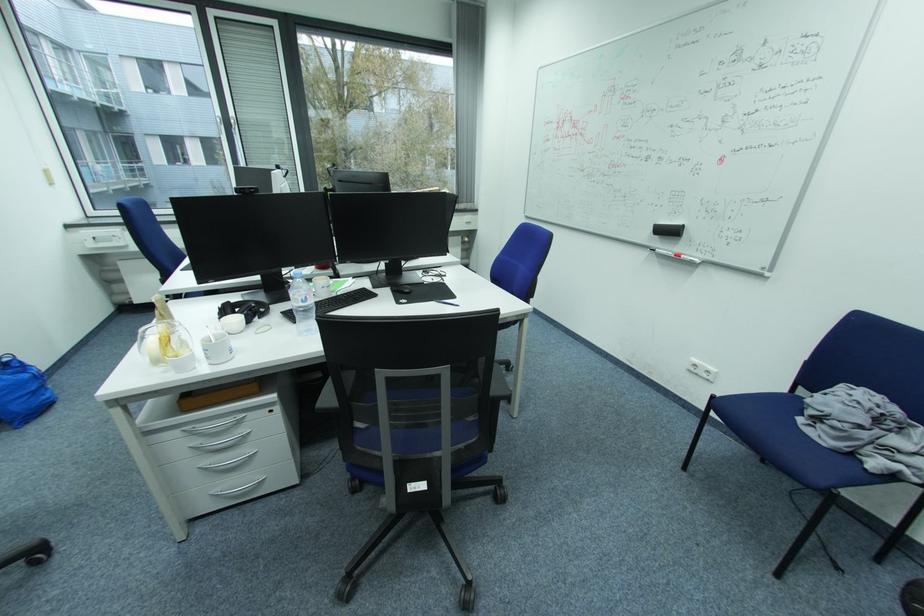
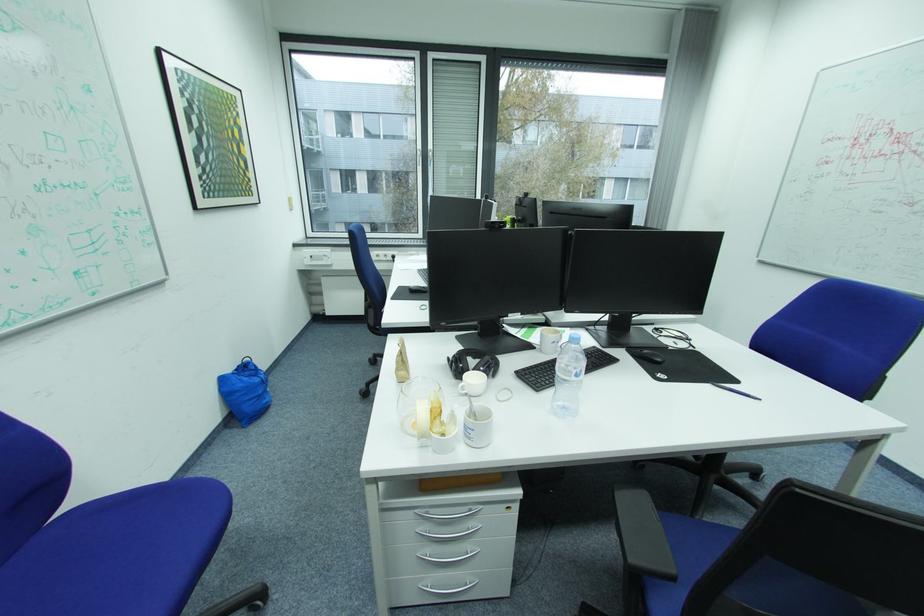
Question: The camera is either moving clockwise (left) or counter-clockwise (right) around the object. The first image is from the beginning of the video and the second image is from the end. Is the camera moving left or right when shooting the video?

Choices:
 (A) Left
 (B) Right

Answer: (B)